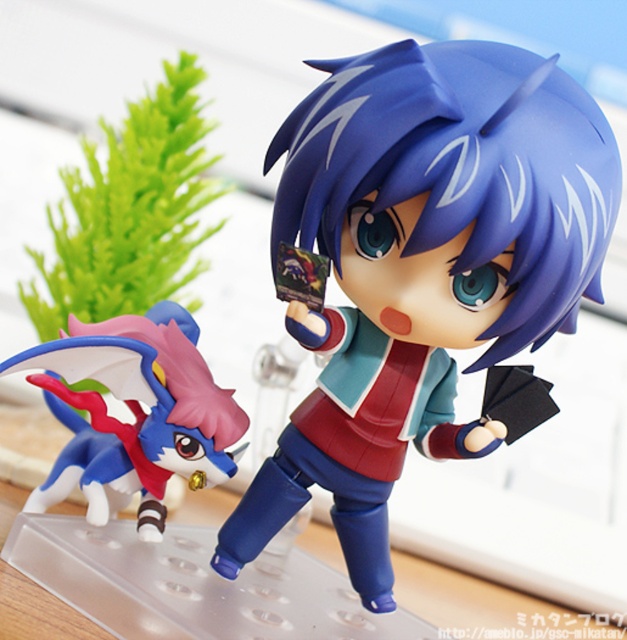
From the picture: You are arranging a shelf and need to place a new item between the matte plastic doll at center and the shiny blue and white plush toy at lower left. Based on their current positions, where should you place the new item to ensure it is between them?

The new item should be placed between the matte plastic doll at center and the shiny blue and white plush toy at lower left, positioning it to the left of the matte plastic doll at center and to the right of the shiny blue and white plush toy at lower left since the matte plastic doll at center is to the right of the shiny blue and white plush toy at lower left.

You are setting up a display and need to place a new figurine between the two existing ones. The new figurine must be placed exactly halfway between the matte plastic doll at center and the other figurine. Given their coordinates, where should you position the new figurine?

The new figurine should be placed at the midpoint between the matte plastic doll at center at point (423, 266) and the other figurine. To find the midpoint, average the x and y coordinates. The midpoint would be at coordinates (423, 266) averaged with the other figurine coordinates. However, since the coordinates of the other figurine aren